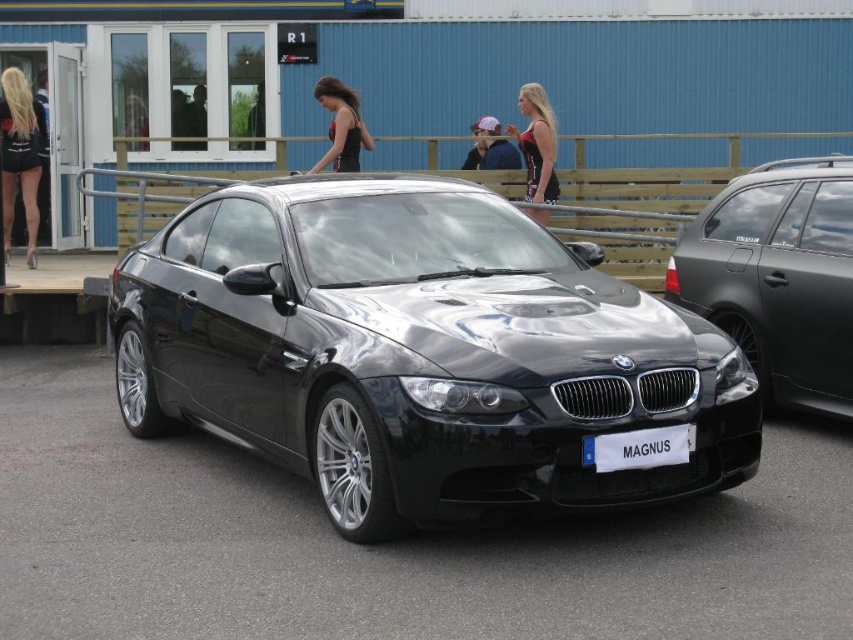
You are a photographer standing in front of the scene. You need to capture a photo where the satin black sedan at right is visible behind the black fabric hair at center. Is this possible based on their positions?

The satin black sedan at right is located below the black fabric hair at center, so yes, it is possible to position the camera such that the sedan appears behind the hair in the photo.

You are standing at the position of point (x=4, y=164) and want to walk to the car. Which direction should you go to reach the car first? The car is located at point (x=561, y=353).

You should walk towards the direction of point (x=561, y=353) because it is in front of your current position at point (x=4, y=164).

You are a photographer trying to capture both the shiny black car at center and the blonde hair at left in a single frame. Based on their widths, which object should you adjust your camera angle to prioritize to ensure both fit without cropping?

The shiny black car at center is wider than the blonde hair at left. To ensure both fit in the frame, prioritize adjusting your angle to accommodate the wider shiny black car at center first, then position the blonde hair at left within the remaining space.